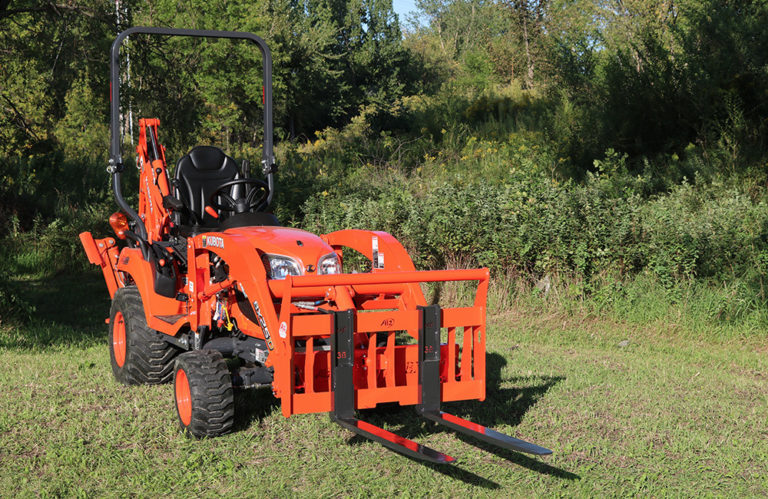
Where is `chair`? This screenshot has width=768, height=499. chair is located at coordinates (206, 167).